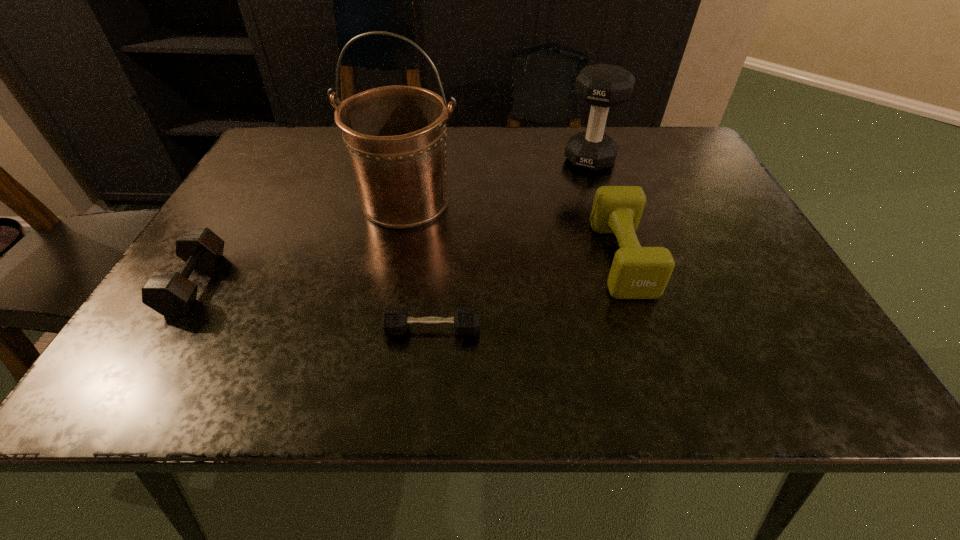
The image size is (960, 540). In order to click on vacant space at the near right corner of the desktop in this screenshot , I will do `click(757, 384)`.

Identify the location of vacant area between the shortest object and the second shortest dumbbell. (313, 306).

Image resolution: width=960 pixels, height=540 pixels. What are the coordinates of `free space between the tallest object and the third dumbbell from right to left` in the screenshot? It's located at [x=419, y=265].

Where is `vacant space in between the third shortest dumbbell and the bucket`? The height and width of the screenshot is (540, 960). vacant space in between the third shortest dumbbell and the bucket is located at coordinates (514, 230).

Find the location of a particular element. The height and width of the screenshot is (540, 960). vacant region between the tallest object and the second dumbbell from left to right is located at coordinates (419, 265).

Locate an element on the screen. The image size is (960, 540). vacant space in between the second tallest object and the nearest dumbbell is located at coordinates (511, 245).

Image resolution: width=960 pixels, height=540 pixels. I want to click on vacant space in between the second tallest dumbbell and the tallest object, so click(514, 230).

The height and width of the screenshot is (540, 960). What are the coordinates of `empty space that is in between the shortest object and the farthest dumbbell` in the screenshot? It's located at (511, 245).

Locate an element on the screen. free space between the nearest dumbbell and the second tallest dumbbell is located at coordinates (527, 294).

At what (x,y) coordinates should I click in order to perform the action: click on object that is the second closest to the second tallest object. Please return your answer as a coordinate pair (x, y). This screenshot has width=960, height=540. Looking at the image, I should click on (395, 135).